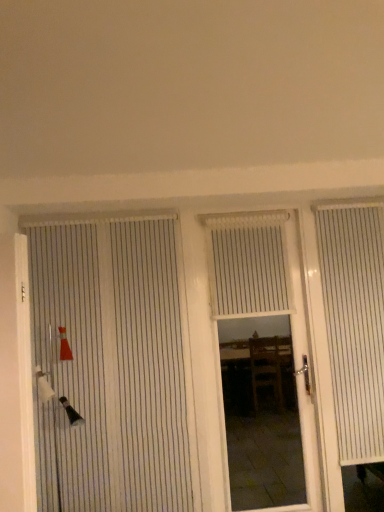
Question: Can you confirm if white striped door at left, the 2th door from the right, is bigger than white textured blind at center?

Choices:
 (A) yes
 (B) no

Answer: (A)

Question: Can you confirm if white striped door at left, the 2th door from the right, is shorter than white textured blind at center?

Choices:
 (A) yes
 (B) no

Answer: (B)

Question: Is white striped door at left, the 2th door from the right, at the left side of white textured blind at center?

Choices:
 (A) yes
 (B) no

Answer: (A)

Question: Considering the relative sizes of white striped door at left, the 2th door from the right, and white textured blind at center in the image provided, is white striped door at left, the 2th door from the right, thinner than white textured blind at center?

Choices:
 (A) no
 (B) yes

Answer: (B)

Question: From the image's perspective, would you say white striped door at left, the first door when ordered from left to right, is positioned over white textured blind at center?

Choices:
 (A) no
 (B) yes

Answer: (A)

Question: From a real-world perspective, is white textured blind at center physically located above or below white wood door at center, marked as the first door in a right-to-left arrangement?

Choices:
 (A) below
 (B) above

Answer: (B)

Question: From their relative heights in the image, would you say white textured blind at center is taller or shorter than white wood door at center, marked as the first door in a right-to-left arrangement?

Choices:
 (A) tall
 (B) short

Answer: (B)

Question: Choose the correct answer: Is white textured blind at center inside white wood door at center, marked as the first door in a right-to-left arrangement, or outside it?

Choices:
 (A) inside
 (B) outside

Answer: (A)

Question: Based on their sizes in the image, would you say white textured blind at center is bigger or smaller than white wood door at center, arranged as the 2th door when viewed from the left?

Choices:
 (A) small
 (B) big

Answer: (A)

Question: Is white striped curtain at right in front of or behind white textured blind at center in the image?

Choices:
 (A) front
 (B) behind

Answer: (A)

Question: Does point (339, 444) appear closer or farther from the camera than point (244, 265)?

Choices:
 (A) closer
 (B) farther

Answer: (A)

Question: From the image's perspective, relative to white textured blind at center, is white striped curtain at right above or below?

Choices:
 (A) below
 (B) above

Answer: (A)

Question: Visually, is white striped curtain at right positioned to the left or to the right of white textured blind at center?

Choices:
 (A) right
 (B) left

Answer: (A)

Question: Is white striped door at left, the first door when ordered from left to right, taller or shorter than white textured blind at center?

Choices:
 (A) tall
 (B) short

Answer: (A)

Question: Does point pyautogui.click(x=195, y=451) appear closer or farther from the camera than point pyautogui.click(x=226, y=224)?

Choices:
 (A) closer
 (B) farther

Answer: (A)